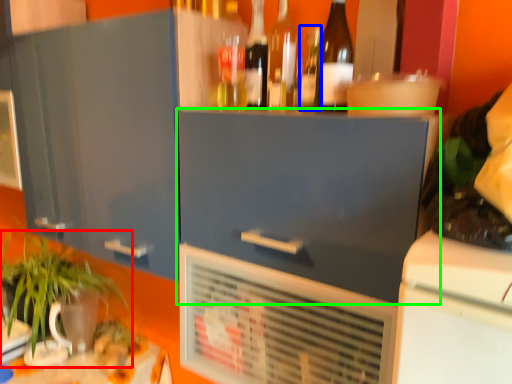
Question: Based on their relative distances, which object is farther from houseplant (highlighted by a red box)? Choose from bottle (highlighted by a blue box) and cabinetry (highlighted by a green box).

Choices:
 (A) bottle
 (B) cabinetry

Answer: (A)